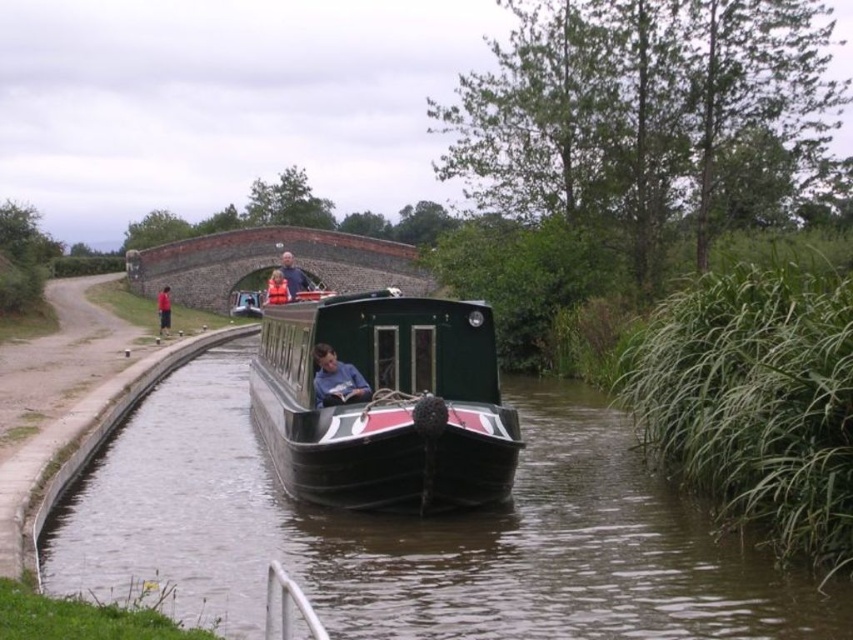
You are a photographer trying to capture a candid shot of the two people sitting in the cabin of the dark green narrowboat. The people are wearing a dark blue shirt at center and an orange fabric jacket at center. Since you want to focus on their clothing, which clothing item would appear narrower in your photo?

The dark blue shirt at center would appear narrower in the photo because it is thinner than the orange fabric jacket at center.

You are a tourist standing on the brick bridge and looking down at the canal. You see the orange fabric jacket at center and the red fabric person at left. Which one is higher in the scene?

The orange fabric jacket at center is higher than the red fabric person at left because it is positioned above them in the scene.